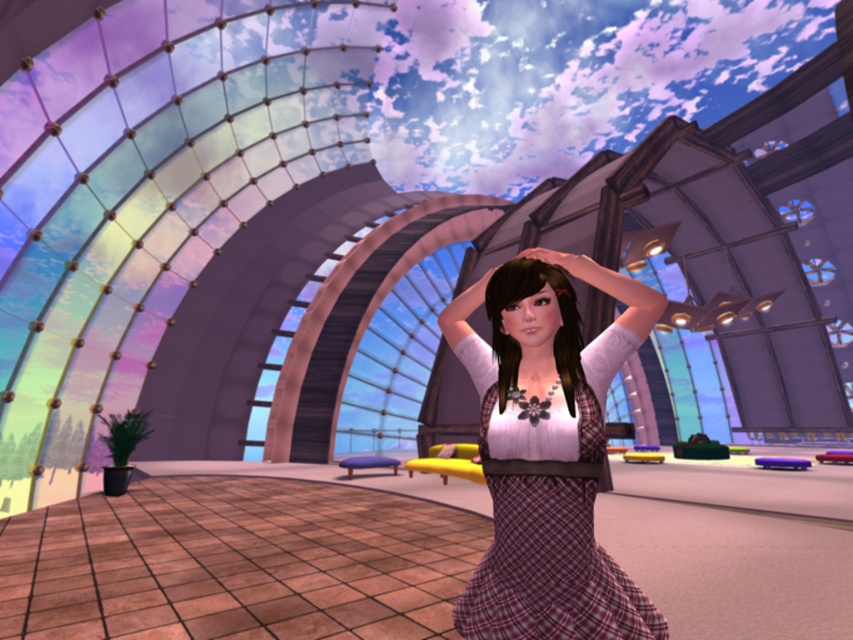
Can you confirm if plaid fabric dress at center is positioned to the right of matte black hair at center?

Yes, plaid fabric dress at center is to the right of matte black hair at center.

Between plaid fabric dress at center and matte black hair at center, which one has less height?

matte black hair at center

This screenshot has width=853, height=640. Find the location of `plaid fabric dress at center`. plaid fabric dress at center is located at coordinates (550, 570).

Between matte black hair at center and pink matte hand at center, which one has less height?

pink matte hand at center

Is matte black hair at center bigger than pink matte hand at center?

Indeed, matte black hair at center has a larger size compared to pink matte hand at center.

Who is more distant from viewer, (490, 310) or (550, 259)?

Positioned behind is point (490, 310).

Identify the location of matte black hair at center. This screenshot has width=853, height=640. (526, 296).

Who is positioned more to the right, plaid fabric dress at center or pink matte hand at center?

Positioned to the right is plaid fabric dress at center.

Does plaid fabric dress at center appear under pink matte hand at center?

Yes.

This screenshot has height=640, width=853. Describe the element at coordinates (550, 570) in the screenshot. I see `plaid fabric dress at center` at that location.

Find the location of a particular element. plaid fabric dress at center is located at coordinates (x=550, y=570).